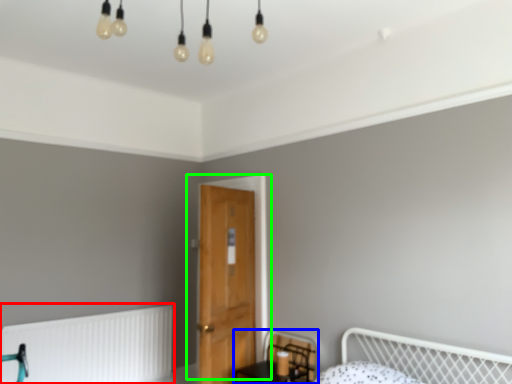
Question: Estimate the real-world distances between objects in this image. Which object is closer to radiator (highlighted by a red box), swivel chair (highlighted by a blue box) or door (highlighted by a green box)?

Choices:
 (A) swivel chair
 (B) door

Answer: (A)